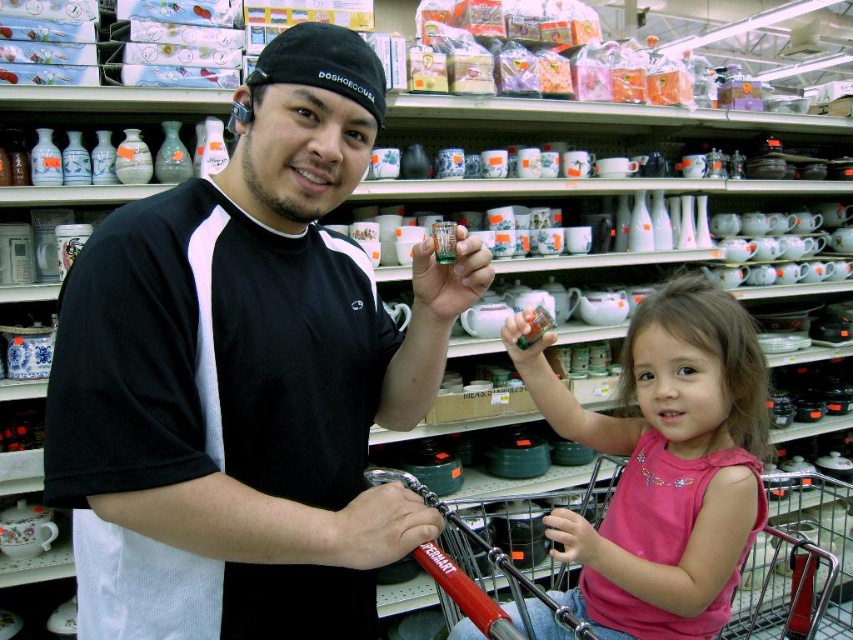
Question: Observing the image, what is the correct spatial positioning of pink fabric shirt at center in reference to metallic red shopping cart at lower center?

Choices:
 (A) above
 (B) below

Answer: (A)

Question: Which of the following is the farthest from the observer?

Choices:
 (A) metallic red shopping cart at lower center
 (B) pink fabric shirt at center

Answer: (A)

Question: Which point is closer to the camera?

Choices:
 (A) black matte shirt at center
 (B) metallic red shopping cart at lower center

Answer: (A)

Question: Which object is closer to the camera taking this photo?

Choices:
 (A) pink fabric shirt at center
 (B) metallic red shopping cart at lower center

Answer: (A)

Question: From the image, what is the correct spatial relationship of pink fabric shirt at center in relation to metallic red shopping cart at lower center?

Choices:
 (A) below
 (B) above

Answer: (B)

Question: Is the position of black matte shirt at center less distant than that of pink fabric shirt at center?

Choices:
 (A) no
 (B) yes

Answer: (B)